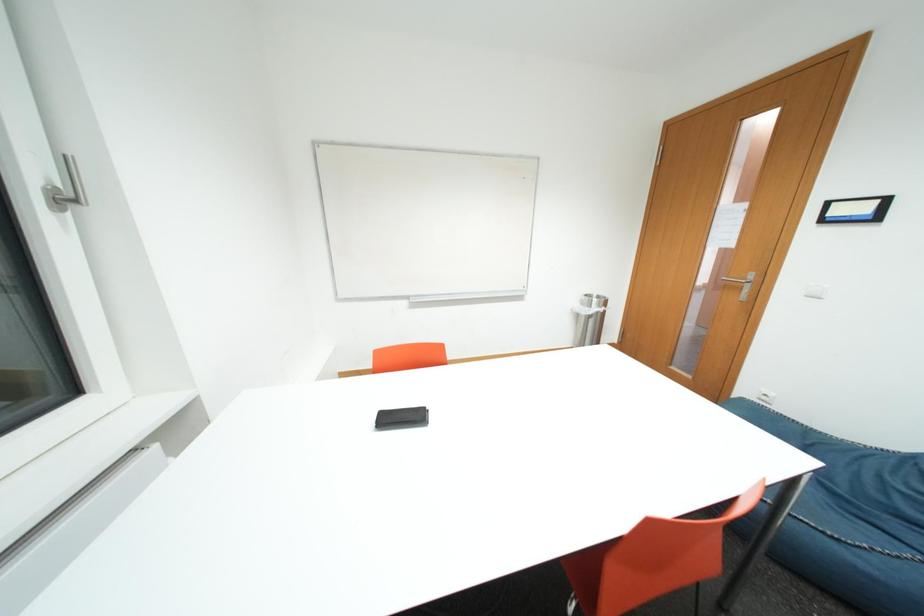
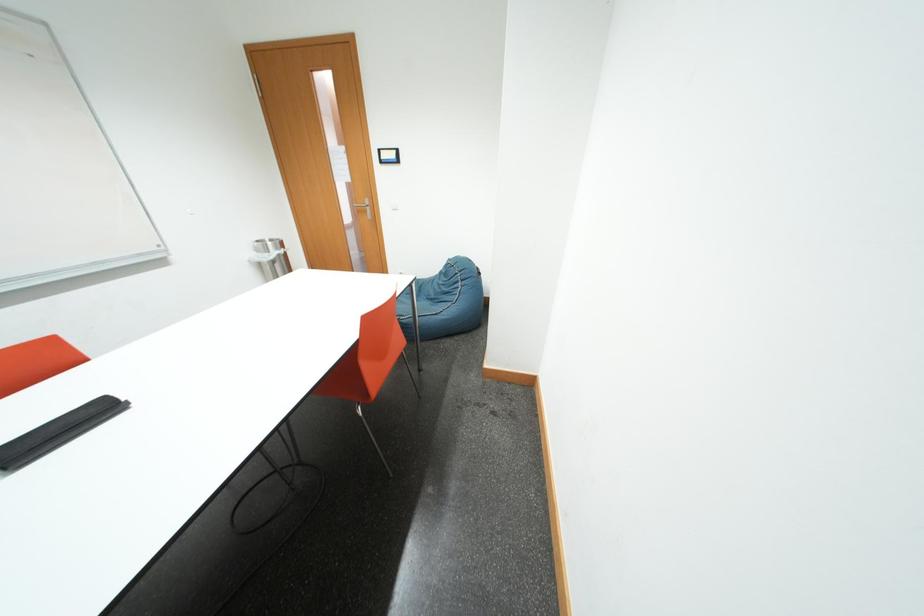
The first image is from the beginning of the video and the second image is from the end. How did the camera likely rotate when shooting the video?

The rotation direction of the camera is right-down.